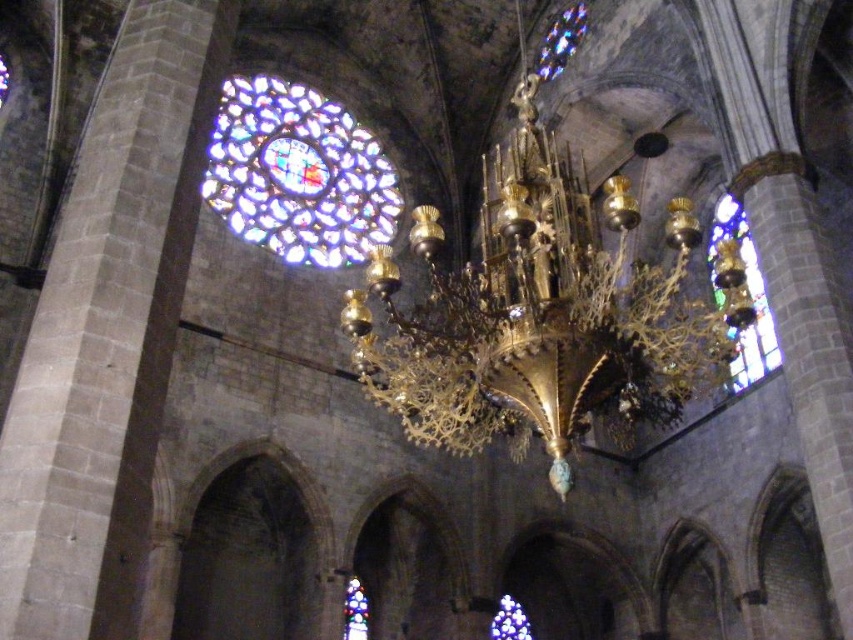
You are an interior designer planning to install a new lighting fixture in the cathedral. You have a gold metallic chandelier at center and a stained glass window at center. Which object is located to the right of the other?

The gold metallic chandelier at center is positioned on the right side of the stained glass window at center.

You are standing in the cathedral and want to take a photo of the stained glass window at right without the gold metallic chandelier at center blocking the view. Is it possible to position yourself in a way that the chandelier is not in front of the window?

The gold metallic chandelier at center is in front of the stained glass window at right, so you cannot position yourself to take a photo of the stained glass window at right without the chandelier blocking the view.

You are standing at point (x=311, y=150) in the cathedral. If you walk straight towards the golden chandelier, will you hit any walls before reaching it?

The distance between you and the golden chandelier is 90.15 meters, so you will not hit any walls before reaching it as there are no obstacles mentioned in the scene description.